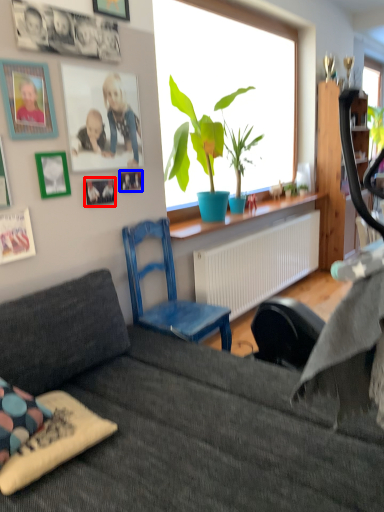
Question: Among these objects, which one is nearest to the camera, picture frame (highlighted by a red box) or picture frame (highlighted by a blue box)?

Choices:
 (A) picture frame
 (B) picture frame

Answer: (A)